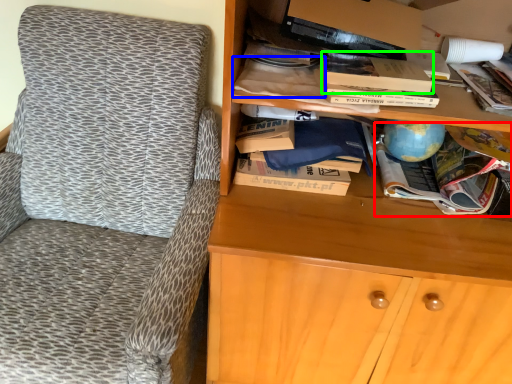
Question: Which object is the closest to the book (highlighted by a red box)? Choose among these: book (highlighted by a blue box) or paperback book (highlighted by a green box).

Choices:
 (A) book
 (B) paperback book

Answer: (B)